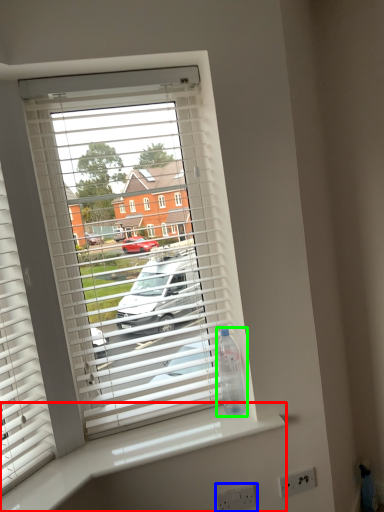
Question: Considering the real-world distances, which object is closest to counter top (highlighted by a red box)? electric outlet (highlighted by a blue box) or bottle (highlighted by a green box).

Choices:
 (A) electric outlet
 (B) bottle

Answer: (B)